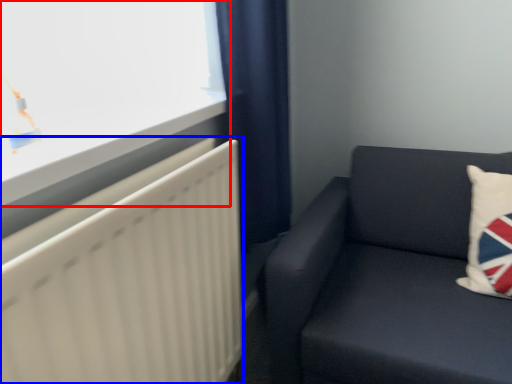
Question: Which of the following is the closest to the observer, window (highlighted by a red box) or radiator (highlighted by a blue box)?

Choices:
 (A) window
 (B) radiator

Answer: (B)